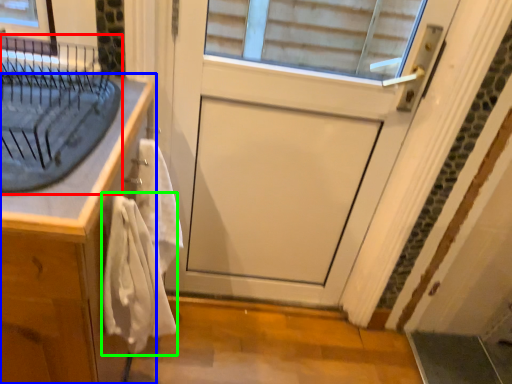
Question: Considering the real-world distances, which object is closest to sink (highlighted by a red box)? cabinetry (highlighted by a blue box) or bath towel (highlighted by a green box).

Choices:
 (A) cabinetry
 (B) bath towel

Answer: (A)